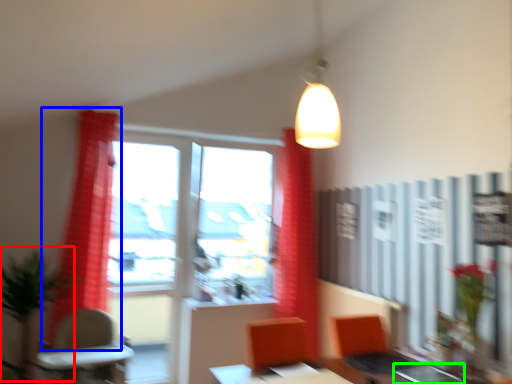
Question: Which is farther away from plant (highlighted by a red box)? curtain (highlighted by a blue box) or table (highlighted by a green box)?

Choices:
 (A) curtain
 (B) table

Answer: (B)